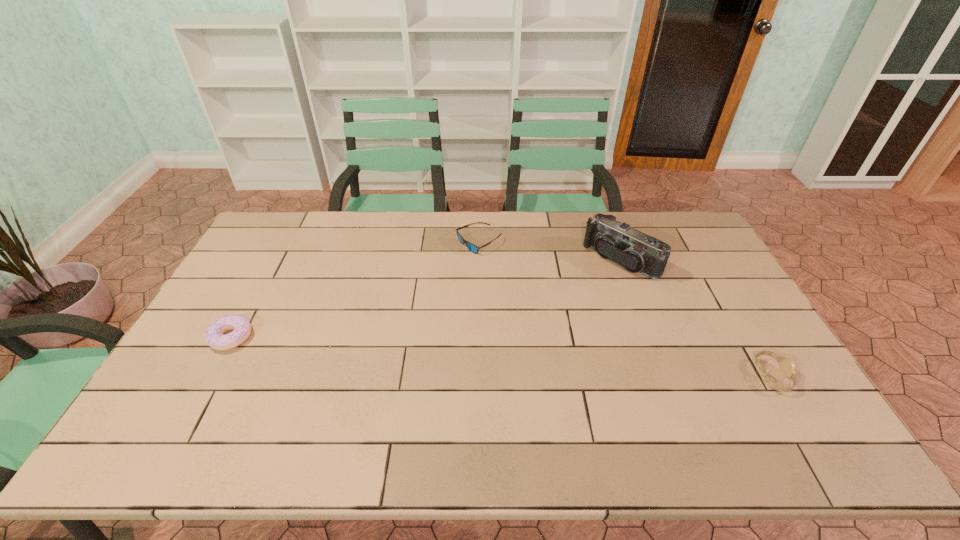
The height and width of the screenshot is (540, 960). In order to click on doughnut in this screenshot , I will do `click(214, 336)`.

Find the location of `the leftmost object`. the leftmost object is located at coordinates (214, 336).

At what (x,y) coordinates should I click in order to perform the action: click on the rightmost object. Please return your answer as a coordinate pair (x, y). The image size is (960, 540). Looking at the image, I should click on 787,366.

Where is `watch`? watch is located at coordinates (787, 366).

What are the coordinates of `the tallest object` in the screenshot? It's located at (636, 251).

This screenshot has width=960, height=540. What are the coordinates of `camcorder` in the screenshot? It's located at (636, 251).

You are a GUI agent. You are given a task and a screenshot of the screen. Output one action in this format:
    pyautogui.click(x=<x>, y=<y>)
    Task: Click on the sunglasses
    This screenshot has height=540, width=960.
    Given the screenshot: What is the action you would take?
    pyautogui.click(x=473, y=248)

Find the location of `free space located on the back of the second nearest object`. free space located on the back of the second nearest object is located at coordinates (280, 248).

You are a GUI agent. You are given a task and a screenshot of the screen. Output one action in this format:
    pyautogui.click(x=<x>, y=<y>)
    Task: Click on the vacant region located 0.320m on the front-facing side of the tallest object
    
    Given the screenshot: What is the action you would take?
    pyautogui.click(x=538, y=327)

Where is `vacant space positioned 0.290m on the front-facing side of the tallest object`? The width and height of the screenshot is (960, 540). vacant space positioned 0.290m on the front-facing side of the tallest object is located at coordinates (544, 321).